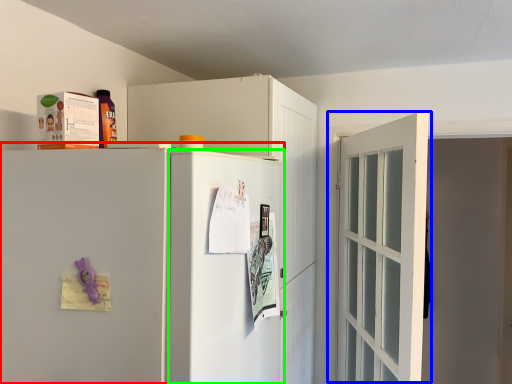
Question: Which object is the farthest from refrigerator (highlighted by a red box)? Choose among these: door (highlighted by a blue box) or screen door (highlighted by a green box).

Choices:
 (A) door
 (B) screen door

Answer: (A)